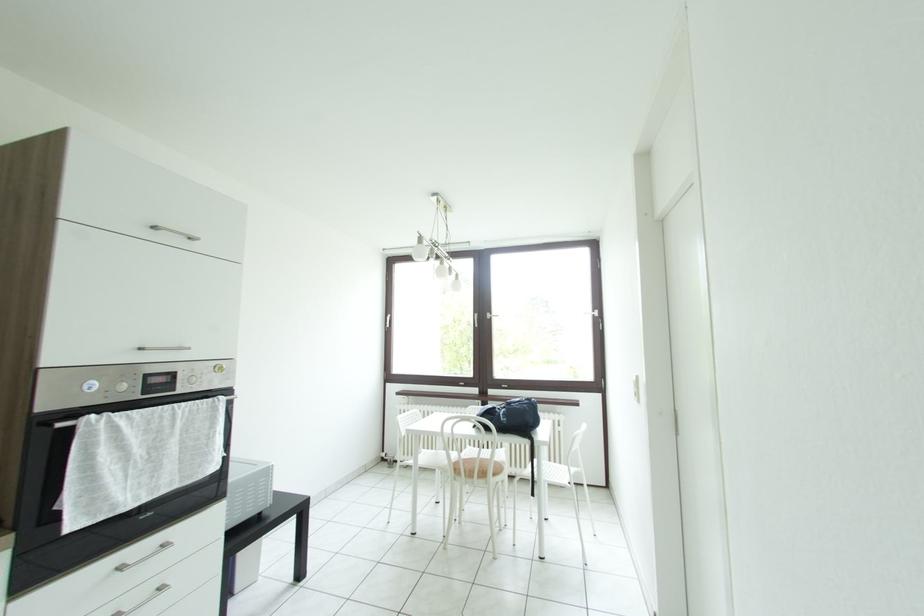
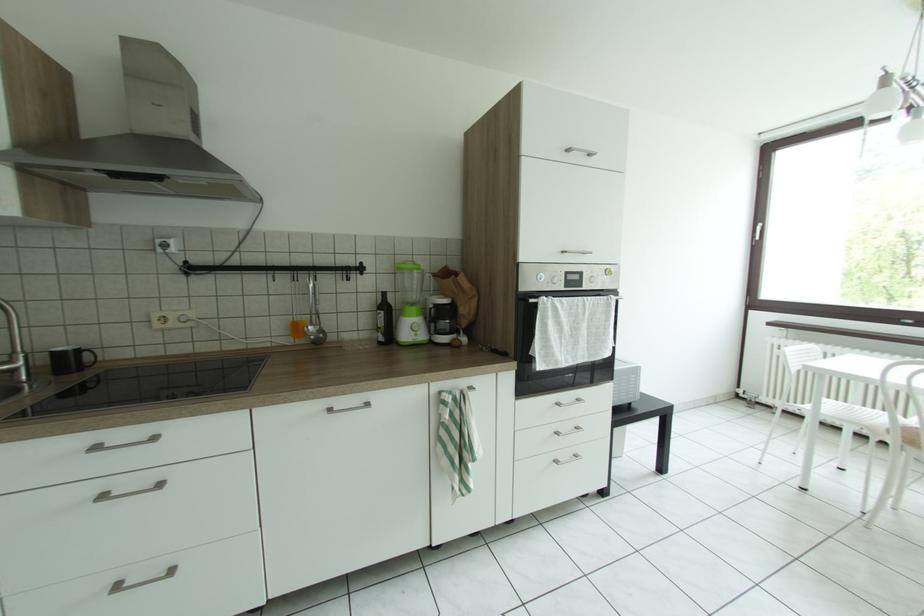
Question: The images are taken continuously from a first-person perspective. In which direction is your viewpoint rotating?

Choices:
 (A) Left
 (B) Right
 (C) Up
 (D) Down

Answer: (A)